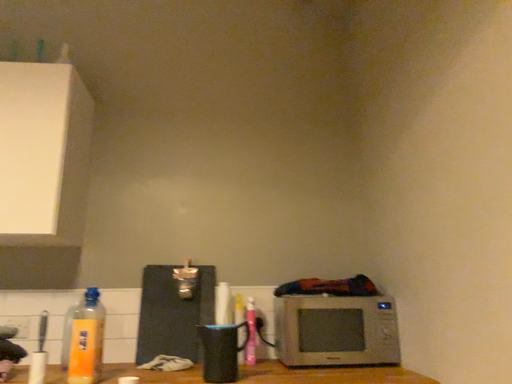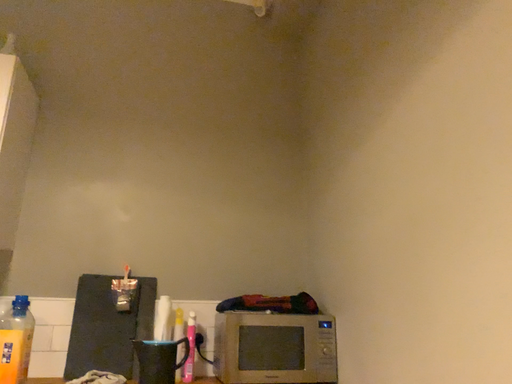
Question: How did the camera likely rotate when shooting the video?

Choices:
 (A) rotated right
 (B) rotated left

Answer: (A)